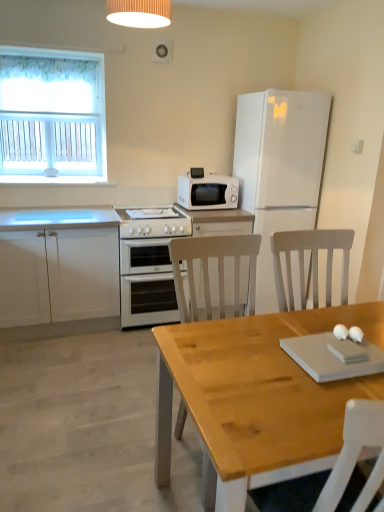
Question: From a real-world perspective, does white fabric curtain at upper left stand above white matte refrigerator at upper right?

Choices:
 (A) no
 (B) yes

Answer: (B)

Question: Considering the relative sizes of white fabric curtain at upper left and white matte refrigerator at upper right in the image provided, is white fabric curtain at upper left smaller than white matte refrigerator at upper right?

Choices:
 (A) yes
 (B) no

Answer: (A)

Question: Does white fabric curtain at upper left appear on the left side of white matte refrigerator at upper right?

Choices:
 (A) yes
 (B) no

Answer: (A)

Question: Is white fabric curtain at upper left far from white matte refrigerator at upper right?

Choices:
 (A) yes
 (B) no

Answer: (A)

Question: Is white fabric curtain at upper left turned away from white matte refrigerator at upper right?

Choices:
 (A) yes
 (B) no

Answer: (B)

Question: Is white fabric curtain at upper left positioned beyond the bounds of white matte refrigerator at upper right?

Choices:
 (A) yes
 (B) no

Answer: (A)

Question: From the image's perspective, is white glossy gas stove at center on top of white fabric curtain at upper left?

Choices:
 (A) yes
 (B) no

Answer: (B)

Question: Does white glossy gas stove at center appear on the left side of white fabric curtain at upper left?

Choices:
 (A) no
 (B) yes

Answer: (A)

Question: Can you confirm if white glossy gas stove at center is positioned to the right of white fabric curtain at upper left?

Choices:
 (A) yes
 (B) no

Answer: (A)

Question: Does white glossy gas stove at center contain white fabric curtain at upper left?

Choices:
 (A) no
 (B) yes

Answer: (A)

Question: Considering the relative sizes of white glossy gas stove at center and white fabric curtain at upper left in the image provided, is white glossy gas stove at center wider than white fabric curtain at upper left?

Choices:
 (A) yes
 (B) no

Answer: (A)

Question: From the image's perspective, is white glossy gas stove at center beneath white fabric curtain at upper left?

Choices:
 (A) no
 (B) yes

Answer: (B)

Question: Is white matte refrigerator at upper right aimed at white glossy oven at center?

Choices:
 (A) no
 (B) yes

Answer: (A)